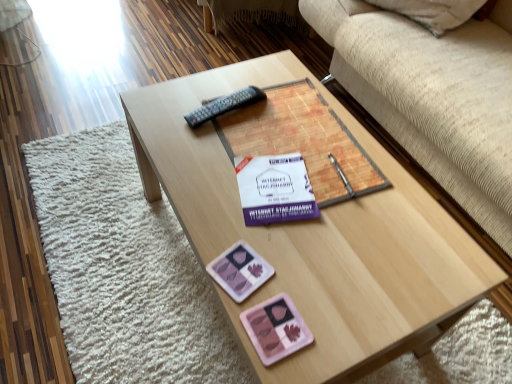
What do you see at coordinates (434, 96) in the screenshot?
I see `beige fabric studio couch at upper right` at bounding box center [434, 96].

What do you see at coordinates (276, 329) in the screenshot? This screenshot has height=384, width=512. I see `pink matte palette at center, which ranks as the second currency in top-to-bottom order` at bounding box center [276, 329].

Image resolution: width=512 pixels, height=384 pixels. I want to click on wooden coffee table at center, so click(x=314, y=235).

Where is `pink plastic at lower center, which appears as the 1th currency when viewed from the top`? pink plastic at lower center, which appears as the 1th currency when viewed from the top is located at coordinates (240, 271).

What is the approximate height of matte paper book at center?

1.61 inches.

In the scene shown: In order to face white paper at center, should I rotate leftwards or rightwards?

Rotate your view right by about 2.589°.

Locate an element on the screen. Image resolution: width=512 pixels, height=384 pixels. beige fabric studio couch at upper right is located at coordinates (434, 96).

Consider the image. Which is nearer, (281, 334) or (233, 285)?

The point (281, 334) is more forward.

Does pink matte palette at center, which is the first currency from bottom to top, have a lesser height compared to pink plastic at lower center, which appears as the 1th currency when viewed from the top?

Yes, pink matte palette at center, which is the first currency from bottom to top, is shorter than pink plastic at lower center, which appears as the 1th currency when viewed from the top.

Does pink matte palette at center, which is the first currency from bottom to top, appear on the right side of pink plastic at lower center, which is the second currency in bottom-to-top order?

Indeed, pink matte palette at center, which is the first currency from bottom to top, is positioned on the right side of pink plastic at lower center, which is the second currency in bottom-to-top order.

Who is smaller, pink matte palette at center, which ranks as the second currency in top-to-bottom order, or pink plastic at lower center, which is the second currency in bottom-to-top order?

Result: pink matte palette at center, which ranks as the second currency in top-to-bottom order.

Starting from the beige fabric studio couch at upper right, which currency is the 1st one to the left? Please provide its 2D coordinates.

[(276, 329)]

Is beige fabric studio couch at upper right taller than pink matte palette at center, which ranks as the second currency in top-to-bottom order?

Correct, beige fabric studio couch at upper right is much taller as pink matte palette at center, which ranks as the second currency in top-to-bottom order.

Considering the positions of objects beige fabric studio couch at upper right and pink matte palette at center, which is the first currency from bottom to top, in the image provided, who is more to the left, beige fabric studio couch at upper right or pink matte palette at center, which is the first currency from bottom to top,?

pink matte palette at center, which is the first currency from bottom to top, is more to the left.

From the image's perspective, who appears lower, beige fabric studio couch at upper right or pink matte palette at center, which ranks as the second currency in top-to-bottom order?

pink matte palette at center, which ranks as the second currency in top-to-bottom order.

From a real-world perspective, between black plastic remote at center and beige fabric studio couch at upper right, who is vertically lower?

In real-world perspective, beige fabric studio couch at upper right is lower.

Is black plastic remote at center placed right next to beige fabric studio couch at upper right?

No, black plastic remote at center is not in contact with beige fabric studio couch at upper right.

From the image's perspective, is black plastic remote at center on top of beige fabric studio couch at upper right?

Incorrect, from the image's perspective, black plastic remote at center is lower than beige fabric studio couch at upper right.

Is wooden coffee table at center looking in the opposite direction of white paper at center?

That's not correct — wooden coffee table at center is not looking away from white paper at center.

Considering the sizes of wooden coffee table at center and white paper at center in the image, is wooden coffee table at center taller or shorter than white paper at center?

Clearly, wooden coffee table at center is taller compared to white paper at center.

I want to click on paperback book that is on the left side of wooden coffee table at center, so click(x=275, y=189).

In the scene shown: From the image's perspective, which one is positioned lower, matte paper book at center or pink matte palette at center, which ranks as the second currency in top-to-bottom order?

pink matte palette at center, which ranks as the second currency in top-to-bottom order, is shown below in the image.

Is matte paper book at center at the right side of pink matte palette at center, which is the first currency from bottom to top?

Yes.

Based on the photo, is matte paper book at center facing away from pink matte palette at center, which is the first currency from bottom to top?

No, matte paper book at center is not facing away from pink matte palette at center, which is the first currency from bottom to top.

Measure the distance from matte paper book at center to pink matte palette at center, which is the first currency from bottom to top.

matte paper book at center is 17.38 inches from pink matte palette at center, which is the first currency from bottom to top.

From a real-world perspective, who is located higher, wooden coffee table at center or pink plastic at lower center, which is the second currency in bottom-to-top order?

pink plastic at lower center, which is the second currency in bottom-to-top order, from a real-world perspective.

Is wooden coffee table at center inside the boundaries of pink plastic at lower center, which is the second currency in bottom-to-top order, or outside?

The correct answer is: outside.

Considering the positions of objects wooden coffee table at center and pink plastic at lower center, which appears as the 1th currency when viewed from the top, in the image provided, who is more to the left, wooden coffee table at center or pink plastic at lower center, which appears as the 1th currency when viewed from the top,?

Positioned to the left is pink plastic at lower center, which appears as the 1th currency when viewed from the top.

Consider the image. Considering the relative sizes of wooden coffee table at center and pink plastic at lower center, which appears as the 1th currency when viewed from the top, in the image provided, is wooden coffee table at center taller than pink plastic at lower center, which appears as the 1th currency when viewed from the top,?

Correct, wooden coffee table at center is much taller as pink plastic at lower center, which appears as the 1th currency when viewed from the top.

Would you say white paper at center is to the left or to the right of pink plastic at lower center, which is the second currency in bottom-to-top order, in the picture?

white paper at center is positioned on pink plastic at lower center, which is the second currency in bottom-to-top order,'s right side.

Does white paper at center have a greater width compared to pink plastic at lower center, which appears as the 1th currency when viewed from the top?

Yes, white paper at center is wider than pink plastic at lower center, which appears as the 1th currency when viewed from the top.

Are white paper at center and pink plastic at lower center, which appears as the 1th currency when viewed from the top, located far from each other?

They are positioned close to each other.

Relative to pink plastic at lower center, which is the second currency in bottom-to-top order, is white paper at center in front or behind?

white paper at center is positioned farther from the viewer than pink plastic at lower center, which is the second currency in bottom-to-top order.

Where is `currency lying above the pink matte palette at center, which ranks as the second currency in top-to-bottom order (from the image's perspective)`? The height and width of the screenshot is (384, 512). currency lying above the pink matte palette at center, which ranks as the second currency in top-to-bottom order (from the image's perspective) is located at coordinates (240, 271).

Starting from the beige fabric studio couch at upper right, which currency is the 1st one to the left? Please provide its 2D coordinates.

[(276, 329)]

Looking at the image, which one is located closer to pink plastic at lower center, which is the second currency in bottom-to-top order, beige fabric studio couch at upper right or white paper at center?

Among the two, white paper at center is located nearer to pink plastic at lower center, which is the second currency in bottom-to-top order.

Considering their positions, is pink plastic at lower center, which is the second currency in bottom-to-top order, positioned further to pink matte palette at center, which ranks as the second currency in top-to-bottom order, than white paper at center?

white paper at center is further to pink matte palette at center, which ranks as the second currency in top-to-bottom order.

When comparing their distances from wooden coffee table at center, does black plastic remote at center or pink matte palette at center, which ranks as the second currency in top-to-bottom order, seem further?

Based on the image, black plastic remote at center appears to be further to wooden coffee table at center.

Based on the photo, from the image, which object appears to be farther from matte paper book at center, beige fabric studio couch at upper right or white paper at center?

The object further to matte paper book at center is beige fabric studio couch at upper right.

Estimate the real-world distances between objects in this image. Which object is closer to pink plastic at lower center, which is the second currency in bottom-to-top order, matte paper book at center or pink matte palette at center, which ranks as the second currency in top-to-bottom order?

pink matte palette at center, which ranks as the second currency in top-to-bottom order, is closer to pink plastic at lower center, which is the second currency in bottom-to-top order.

When comparing their distances from white paper at center, does beige fabric studio couch at upper right or pink plastic at lower center, which is the second currency in bottom-to-top order, seem closer?

pink plastic at lower center, which is the second currency in bottom-to-top order, is closer to white paper at center.

In the scene shown: Based on their spatial positions, is pink plastic at lower center, which is the second currency in bottom-to-top order, or black plastic remote at center further from wooden coffee table at center?

The object further to wooden coffee table at center is black plastic remote at center.

From the image, which object appears to be nearer to pink plastic at lower center, which appears as the 1th currency when viewed from the top, black plastic remote at center or white paper at center?

white paper at center is closer to pink plastic at lower center, which appears as the 1th currency when viewed from the top.

Where is `coffee table between black plastic remote at center and pink plastic at lower center, which is the second currency in bottom-to-top order, vertically`? The height and width of the screenshot is (384, 512). coffee table between black plastic remote at center and pink plastic at lower center, which is the second currency in bottom-to-top order, vertically is located at coordinates (314, 235).

At what (x,y) coordinates should I click in order to perform the action: click on paperback book located between pink plastic at lower center, which is the second currency in bottom-to-top order, and beige fabric studio couch at upper right in the left-right direction. Please return your answer as a coordinate pair (x, y). This screenshot has width=512, height=384. Looking at the image, I should click on (275, 189).

The width and height of the screenshot is (512, 384). I want to click on coffee table located between pink matte palette at center, which is the first currency from bottom to top, and beige fabric studio couch at upper right in the left-right direction, so click(314, 235).

In order to click on book that lies between black plastic remote at center and pink plastic at lower center, which appears as the 1th currency when viewed from the top, from top to bottom in this screenshot , I will do `click(303, 141)`.